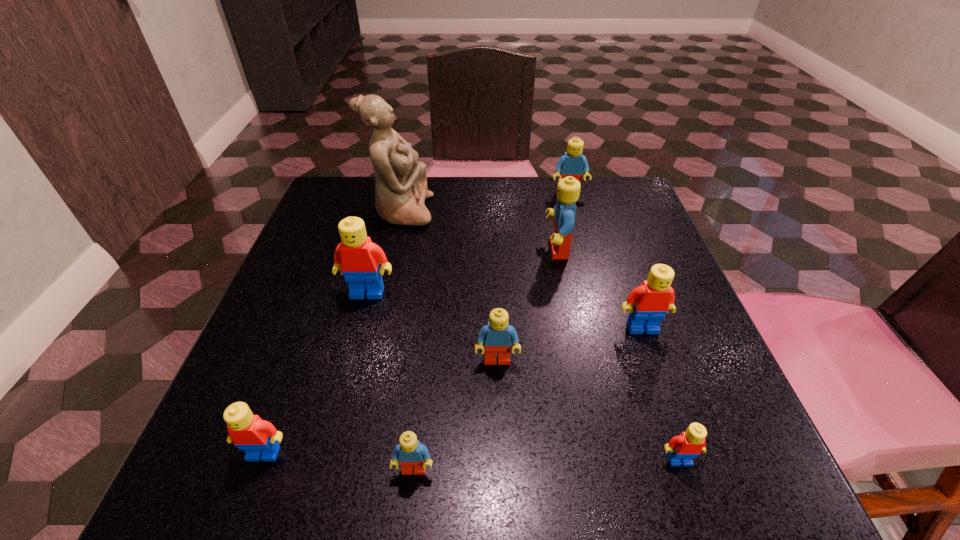
This screenshot has height=540, width=960. In order to click on object that is at the near right corner in this screenshot , I will do `click(682, 449)`.

Where is `free location at the far edge`? free location at the far edge is located at coordinates (490, 195).

The width and height of the screenshot is (960, 540). In the image, there is a desktop. What are the coordinates of `free space at the left edge` in the screenshot? It's located at (316, 269).

Find the location of a particular element. free space at the right edge is located at coordinates (636, 240).

The height and width of the screenshot is (540, 960). What are the coordinates of `free space at the far left corner of the desktop` in the screenshot? It's located at (325, 197).

What are the coordinates of `free space at the near right corner of the desktop` in the screenshot? It's located at (664, 451).

Where is `vacant area that lies between the smallest red Lego and the farthest red Lego`? The width and height of the screenshot is (960, 540). vacant area that lies between the smallest red Lego and the farthest red Lego is located at coordinates (523, 376).

Find the location of `unoccupied position between the smallest blue Lego and the fifth nearest Lego`. unoccupied position between the smallest blue Lego and the fifth nearest Lego is located at coordinates (528, 399).

Locate an element on the screen. The width and height of the screenshot is (960, 540). vacant area that lies between the fifth Lego from right to left and the farthest red Lego is located at coordinates (432, 327).

This screenshot has width=960, height=540. I want to click on free space between the second biggest blue Lego and the smallest red Lego, so click(624, 326).